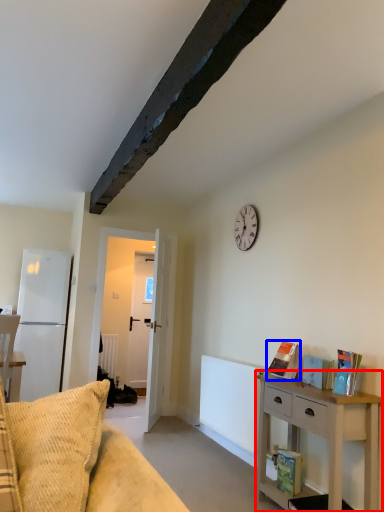
Question: Which point is closer to the camera, nightstand (highlighted by a red box) or book (highlighted by a blue box)?

Choices:
 (A) nightstand
 (B) book

Answer: (A)